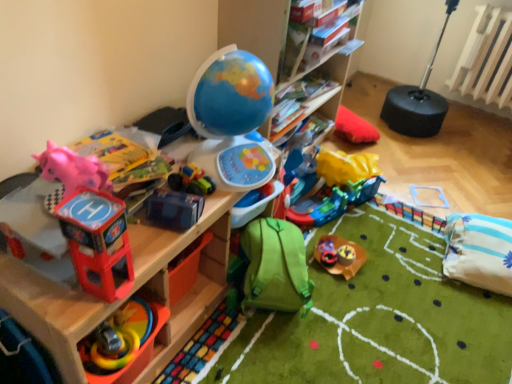
Identify the location of free space above rubberized plastic toy at lower left, arranged as the 8th toy when viewed from the right (from a real-world perspective). (114, 332).